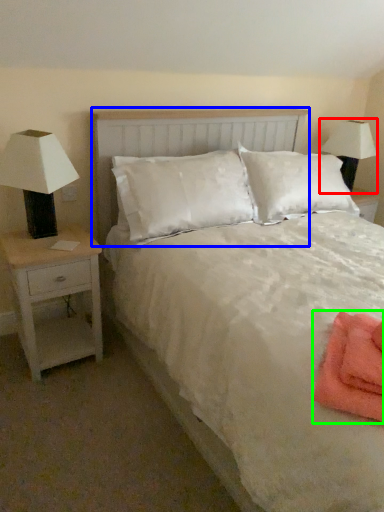
Question: Estimate the real-world distances between objects in this image. Which object is closer to lamp (highlighted by a red box), headboard (highlighted by a blue box) or material (highlighted by a green box)?

Choices:
 (A) headboard
 (B) material

Answer: (A)